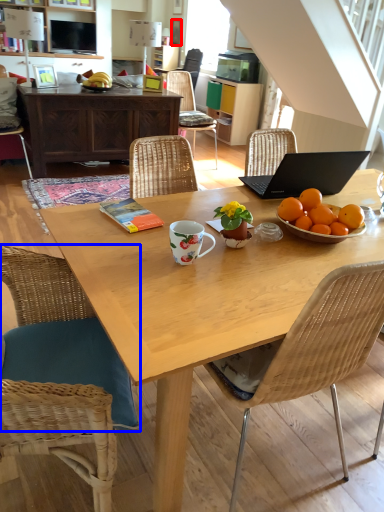
Question: Which point is further to the camera, picture frame (highlighted by a red box) or chair (highlighted by a blue box)?

Choices:
 (A) picture frame
 (B) chair

Answer: (A)